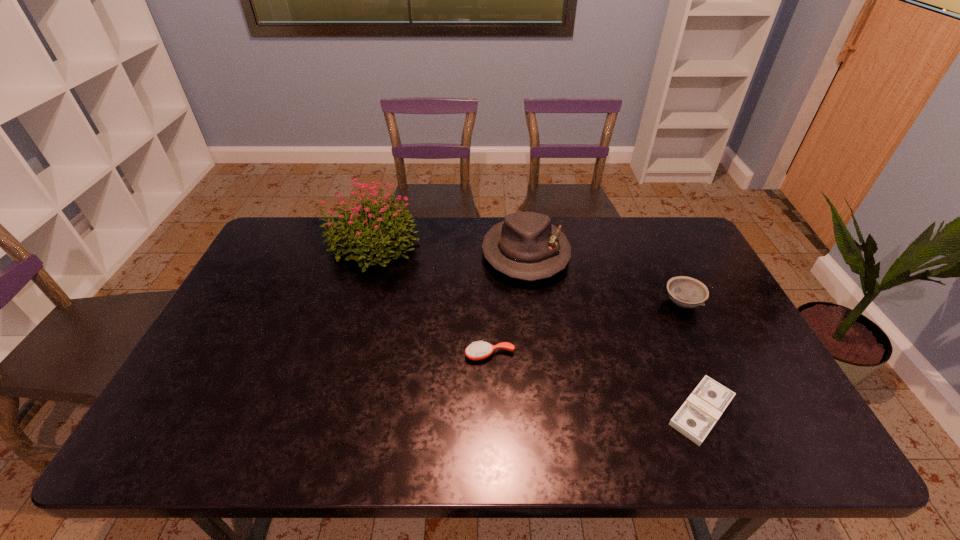
Find the location of a particular element. This screenshot has width=960, height=540. vacant space at the near edge is located at coordinates pyautogui.click(x=260, y=438).

At what (x,y) coordinates should I click in order to perform the action: click on free space at the left edge. Please return your answer as a coordinate pair (x, y). Image resolution: width=960 pixels, height=540 pixels. Looking at the image, I should click on (254, 354).

This screenshot has height=540, width=960. What are the coordinates of `vacant space at the right edge of the desktop` in the screenshot? It's located at (722, 360).

In the image, there is a desktop. Identify the location of vacant space at the far left corner. The height and width of the screenshot is (540, 960). (292, 217).

Identify the location of unoccupied area between the nearest object and the leftmost object. This screenshot has height=540, width=960. (537, 328).

This screenshot has width=960, height=540. Identify the location of free space between the fourth shortest object and the fourth tallest object. (508, 305).

Find the location of a particular element. The height and width of the screenshot is (540, 960). free space that is in between the third shortest object and the fourth tallest object is located at coordinates (586, 329).

Where is `free area in between the bowl and the fourth tallest object`? The height and width of the screenshot is (540, 960). free area in between the bowl and the fourth tallest object is located at coordinates (x=586, y=329).

I want to click on free space that is in between the hairbrush and the bowl, so click(586, 329).

Identify the location of vacant point located between the nearest object and the leftmost object. This screenshot has width=960, height=540. (537, 328).